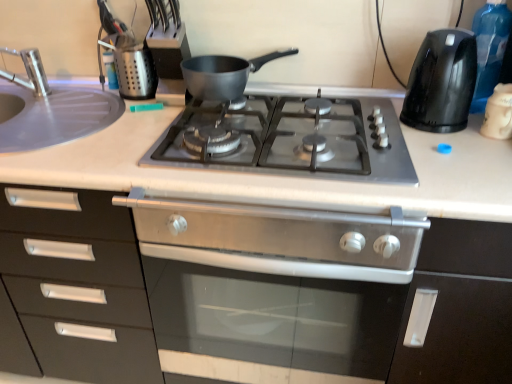
Where is `vacant space in front of metallic silver utensil holder at upper left`? vacant space in front of metallic silver utensil holder at upper left is located at coordinates (116, 117).